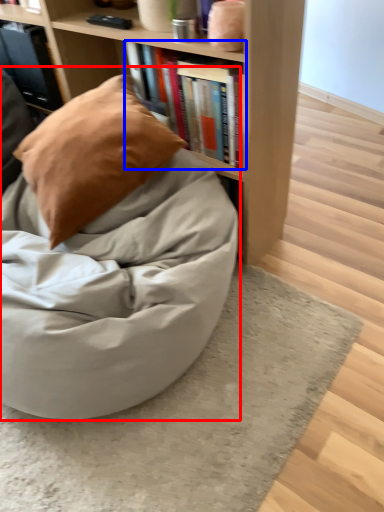
Question: Which point is closer to the camera, bean bag chair (highlighted by a red box) or book (highlighted by a blue box)?

Choices:
 (A) bean bag chair
 (B) book

Answer: (A)